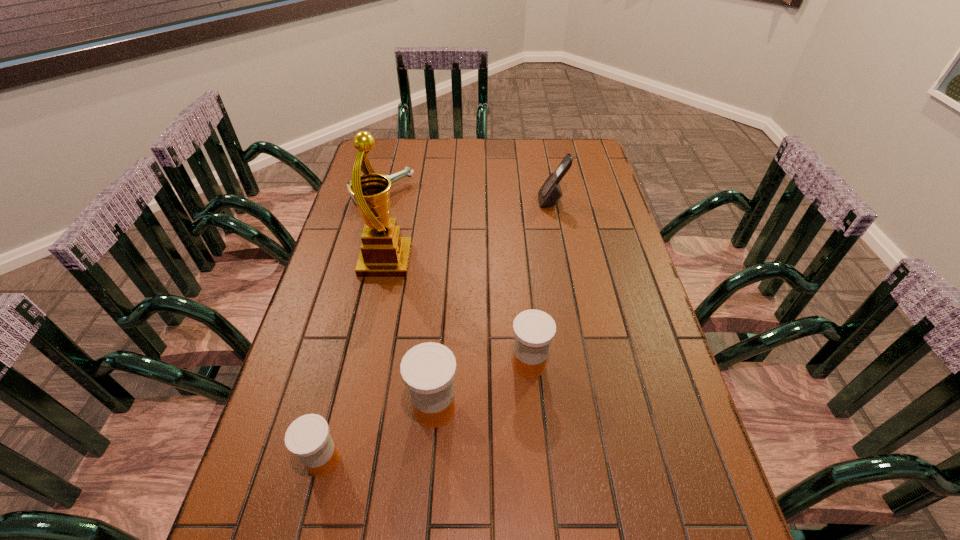
Identify the location of free space at the right edge of the desktop. Image resolution: width=960 pixels, height=540 pixels. (636, 284).

The height and width of the screenshot is (540, 960). I want to click on free space at the far left corner of the desktop, so click(x=393, y=140).

The width and height of the screenshot is (960, 540). In order to click on free region at the near right corner in this screenshot , I will do `click(681, 467)`.

What are the coordinates of `unoccupied area between the fourth nearest object and the rightmost object` in the screenshot? It's located at (468, 231).

I want to click on vacant space that's between the fourth tallest object and the award, so click(458, 313).

I want to click on empty location between the rightmost object and the second medicine from left to right, so click(493, 305).

Locate an element on the screen. This screenshot has height=540, width=960. free space between the rightmost object and the fifth tallest object is located at coordinates (438, 330).

This screenshot has height=540, width=960. Identify the location of vacant point located between the rightmost object and the bottle. (468, 198).

Where is `free space between the bottle and the leftmost medicine`? This screenshot has width=960, height=540. free space between the bottle and the leftmost medicine is located at coordinates (352, 328).

What are the coordinates of `vacant area between the fifth farthest object and the shortest object` in the screenshot? It's located at (409, 302).